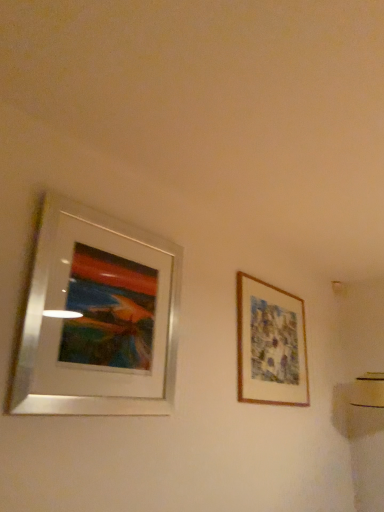
Based on the photo, measure the distance between point (x=146, y=263) and camera.

Point (x=146, y=263) and camera are 6.44 feet apart from each other.

Identify the location of silver metallic picture frame at left, placed as the 1th picture frame when sorted from left to right. This screenshot has height=512, width=384. (98, 318).

Measure the distance between silver metallic picture frame at left, which is the first picture frame in front-to-back order, and camera.

silver metallic picture frame at left, which is the first picture frame in front-to-back order, and camera are 4.54 feet apart from each other.

Describe the element at coordinates (98, 318) in the screenshot. I see `silver metallic picture frame at left, acting as the second picture frame starting from the back` at that location.

Identify the location of wooden framed artwork at right, arranged as the second picture frame when viewed from the left. The width and height of the screenshot is (384, 512). (270, 345).

The width and height of the screenshot is (384, 512). What do you see at coordinates (270, 345) in the screenshot?
I see `wooden framed artwork at right, arranged as the second picture frame when viewed from the left` at bounding box center [270, 345].

I want to click on silver metallic picture frame at left, which is the first picture frame in front-to-back order, so click(98, 318).

Can you confirm if wooden framed artwork at right, which appears as the first picture frame when viewed from the right, is positioned to the left of silver metallic picture frame at left, placed as the 1th picture frame when sorted from left to right?

No, wooden framed artwork at right, which appears as the first picture frame when viewed from the right, is not to the left of silver metallic picture frame at left, placed as the 1th picture frame when sorted from left to right.

Considering the positions of objects wooden framed artwork at right, arranged as the second picture frame when viewed from the left, and silver metallic picture frame at left, acting as the second picture frame starting from the back, in the image provided, who is behind, wooden framed artwork at right, arranged as the second picture frame when viewed from the left, or silver metallic picture frame at left, acting as the second picture frame starting from the back,?

wooden framed artwork at right, arranged as the second picture frame when viewed from the left, is behind.

Which is behind, point (296, 312) or point (72, 234)?

Point (296, 312)

From the image's perspective, which object appears higher, wooden framed artwork at right, which appears as the first picture frame when viewed from the right, or silver metallic picture frame at left, positioned as the second picture frame in right-to-left order?

silver metallic picture frame at left, positioned as the second picture frame in right-to-left order, is shown above in the image.

From a real-world perspective, is wooden framed artwork at right, arranged as the second picture frame when viewed from the left, under silver metallic picture frame at left, which is the first picture frame in front-to-back order?

No, from a real-world perspective, wooden framed artwork at right, arranged as the second picture frame when viewed from the left, is not below silver metallic picture frame at left, which is the first picture frame in front-to-back order.

Considering the sizes of wooden framed artwork at right, which appears as the first picture frame when viewed from the right, and silver metallic picture frame at left, positioned as the second picture frame in right-to-left order, in the image, is wooden framed artwork at right, which appears as the first picture frame when viewed from the right, wider or thinner than silver metallic picture frame at left, positioned as the second picture frame in right-to-left order,?

Clearly, wooden framed artwork at right, which appears as the first picture frame when viewed from the right, has less width compared to silver metallic picture frame at left, positioned as the second picture frame in right-to-left order.

Is wooden framed artwork at right, marked as the second picture frame in a front-to-back arrangement, taller or shorter than silver metallic picture frame at left, positioned as the second picture frame in right-to-left order?

In the image, wooden framed artwork at right, marked as the second picture frame in a front-to-back arrangement, appears to be shorter than silver metallic picture frame at left, positioned as the second picture frame in right-to-left order.

In terms of size, does wooden framed artwork at right, marked as the second picture frame in a front-to-back arrangement, appear bigger or smaller than silver metallic picture frame at left, which is the first picture frame in front-to-back order?

wooden framed artwork at right, marked as the second picture frame in a front-to-back arrangement, is smaller than silver metallic picture frame at left, which is the first picture frame in front-to-back order.

Is wooden framed artwork at right, which appears as the first picture frame when viewed from the right, inside the boundaries of silver metallic picture frame at left, acting as the second picture frame starting from the back, or outside?

wooden framed artwork at right, which appears as the first picture frame when viewed from the right, lies outside silver metallic picture frame at left, acting as the second picture frame starting from the back.

In the scene shown: Are wooden framed artwork at right, acting as the 1th picture frame starting from the back, and silver metallic picture frame at left, placed as the 1th picture frame when sorted from left to right, far apart?

wooden framed artwork at right, acting as the 1th picture frame starting from the back, is actually quite close to silver metallic picture frame at left, placed as the 1th picture frame when sorted from left to right.

Is wooden framed artwork at right, which appears as the first picture frame when viewed from the right, oriented away from silver metallic picture frame at left, placed as the 1th picture frame when sorted from left to right?

wooden framed artwork at right, which appears as the first picture frame when viewed from the right, does not have its back to silver metallic picture frame at left, placed as the 1th picture frame when sorted from left to right.

Can you tell me how much wooden framed artwork at right, which appears as the first picture frame when viewed from the right, and silver metallic picture frame at left, placed as the 1th picture frame when sorted from left to right, differ in facing direction?

wooden framed artwork at right, which appears as the first picture frame when viewed from the right, and silver metallic picture frame at left, placed as the 1th picture frame when sorted from left to right, are facing 0.00249 degrees away from each other.

Measure the distance between wooden framed artwork at right, acting as the 1th picture frame starting from the back, and silver metallic picture frame at left, positioned as the second picture frame in right-to-left order.

A distance of 37.99 inches exists between wooden framed artwork at right, acting as the 1th picture frame starting from the back, and silver metallic picture frame at left, positioned as the second picture frame in right-to-left order.

Locate an element on the screen. picture frame in front of the wooden framed artwork at right, acting as the 1th picture frame starting from the back is located at coordinates (98, 318).

Is silver metallic picture frame at left, acting as the second picture frame starting from the back, to the left of wooden framed artwork at right, which appears as the first picture frame when viewed from the right, from the viewer's perspective?

Correct, you'll find silver metallic picture frame at left, acting as the second picture frame starting from the back, to the left of wooden framed artwork at right, which appears as the first picture frame when viewed from the right.

Considering their positions, is silver metallic picture frame at left, acting as the second picture frame starting from the back, located in front of or behind wooden framed artwork at right, which appears as the first picture frame when viewed from the right?

In the image, silver metallic picture frame at left, acting as the second picture frame starting from the back, appears in front of wooden framed artwork at right, which appears as the first picture frame when viewed from the right.

Does point (30, 311) appear closer or farther from the camera than point (296, 358)?

Clearly, point (30, 311) is closer to the camera than point (296, 358).

From the image's perspective, relative to wooden framed artwork at right, which appears as the first picture frame when viewed from the right, is silver metallic picture frame at left, acting as the second picture frame starting from the back, above or below?

silver metallic picture frame at left, acting as the second picture frame starting from the back, is situated higher than wooden framed artwork at right, which appears as the first picture frame when viewed from the right, in the image.

From a real-world perspective, which object stands above the other?

wooden framed artwork at right, arranged as the second picture frame when viewed from the left.

Can you confirm if silver metallic picture frame at left, placed as the 1th picture frame when sorted from left to right, is thinner than wooden framed artwork at right, which appears as the first picture frame when viewed from the right?

No.

Between silver metallic picture frame at left, placed as the 1th picture frame when sorted from left to right, and wooden framed artwork at right, which appears as the first picture frame when viewed from the right, which one has less height?

With less height is wooden framed artwork at right, which appears as the first picture frame when viewed from the right.

Considering the sizes of silver metallic picture frame at left, positioned as the second picture frame in right-to-left order, and wooden framed artwork at right, arranged as the second picture frame when viewed from the left, in the image, is silver metallic picture frame at left, positioned as the second picture frame in right-to-left order, bigger or smaller than wooden framed artwork at right, arranged as the second picture frame when viewed from the left,?

Clearly, silver metallic picture frame at left, positioned as the second picture frame in right-to-left order, is larger in size than wooden framed artwork at right, arranged as the second picture frame when viewed from the left.

Would you say silver metallic picture frame at left, which is the first picture frame in front-to-back order, is inside or outside wooden framed artwork at right, arranged as the second picture frame when viewed from the left?

The correct answer is: outside.

Is silver metallic picture frame at left, acting as the second picture frame starting from the back, not close to wooden framed artwork at right, which appears as the first picture frame when viewed from the right?

No.

Is silver metallic picture frame at left, positioned as the second picture frame in right-to-left order, oriented away from wooden framed artwork at right, arranged as the second picture frame when viewed from the left?

That's not correct — silver metallic picture frame at left, positioned as the second picture frame in right-to-left order, is not looking away from wooden framed artwork at right, arranged as the second picture frame when viewed from the left.

Where is `picture frame that appears above the silver metallic picture frame at left, acting as the second picture frame starting from the back (from a real-world perspective)`? picture frame that appears above the silver metallic picture frame at left, acting as the second picture frame starting from the back (from a real-world perspective) is located at coordinates (270, 345).

Locate an element on the screen. Image resolution: width=384 pixels, height=512 pixels. picture frame in front of the wooden framed artwork at right, arranged as the second picture frame when viewed from the left is located at coordinates (98, 318).

Locate an element on the screen. The width and height of the screenshot is (384, 512). picture frame behind the silver metallic picture frame at left, acting as the second picture frame starting from the back is located at coordinates (270, 345).